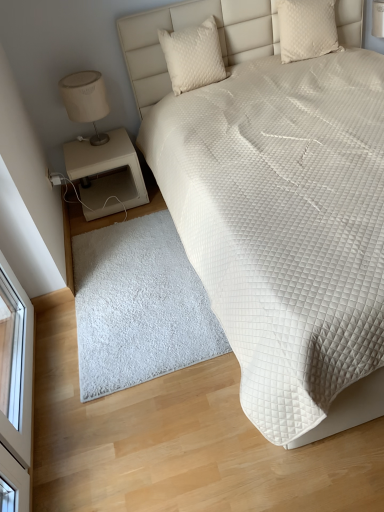
Question: Choose the correct answer: Is quilted cream pillow at upper center, arranged as the second pillow when viewed from the right, inside beige matte nightstand at lower left or outside it?

Choices:
 (A) inside
 (B) outside

Answer: (B)

Question: Based on their sizes in the image, would you say quilted cream pillow at upper center, arranged as the second pillow when viewed from the right, is bigger or smaller than beige matte nightstand at lower left?

Choices:
 (A) small
 (B) big

Answer: (A)

Question: Which of these objects is positioned closest to the white quilted bed at upper right?

Choices:
 (A) matte beige lampshade at left
 (B) white fluffy rug at lower center
 (C) beige matte nightstand at lower left
 (D) quilted cream pillow at upper center, arranged as the second pillow when viewed from the right
 (E) white quilted pillow at upper right, arranged as the first pillow when viewed from the right

Answer: (B)

Question: Which is farther from the white quilted bed at upper right?

Choices:
 (A) beige matte nightstand at lower left
 (B) matte beige lampshade at left
 (C) white quilted pillow at upper right, arranged as the first pillow when viewed from the right
 (D) quilted cream pillow at upper center, arranged as the second pillow when viewed from the right
 (E) white fluffy rug at lower center

Answer: (C)